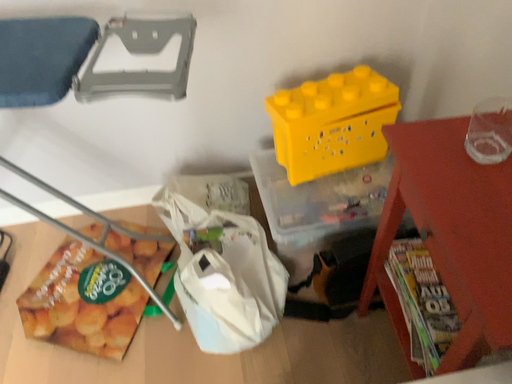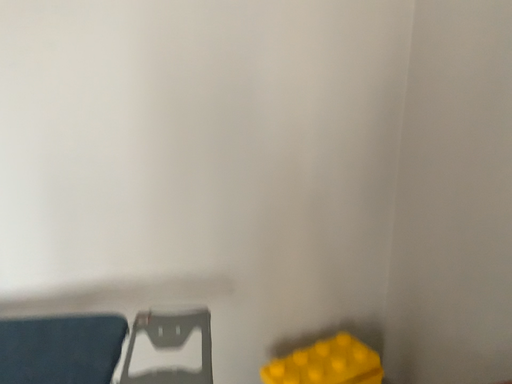
Question: Which way did the camera rotate in the video?

Choices:
 (A) rotated downward
 (B) rotated upward

Answer: (B)